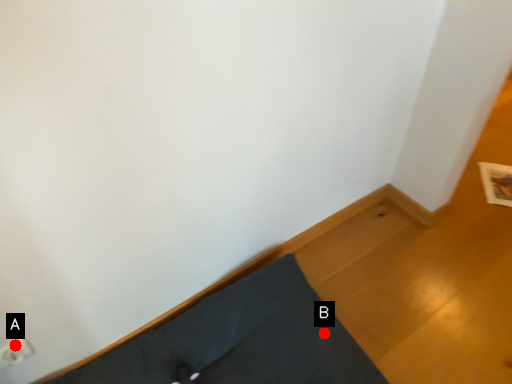
Question: Two points are circled on the image, labeled by A and B beside each circle. Which point is farther to the camera?

Choices:
 (A) A is further
 (B) B is further

Answer: (B)